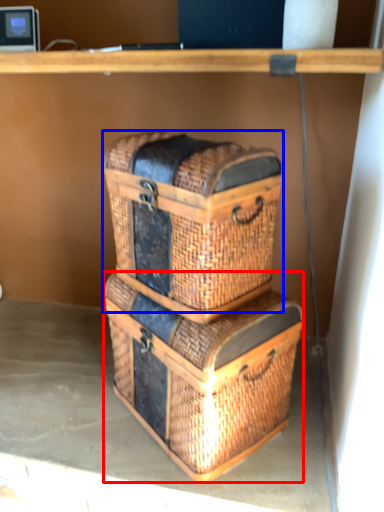
Question: Which point is closer to the camera, crate (highlighted by a red box) or basket container (highlighted by a blue box)?

Choices:
 (A) crate
 (B) basket container

Answer: (B)